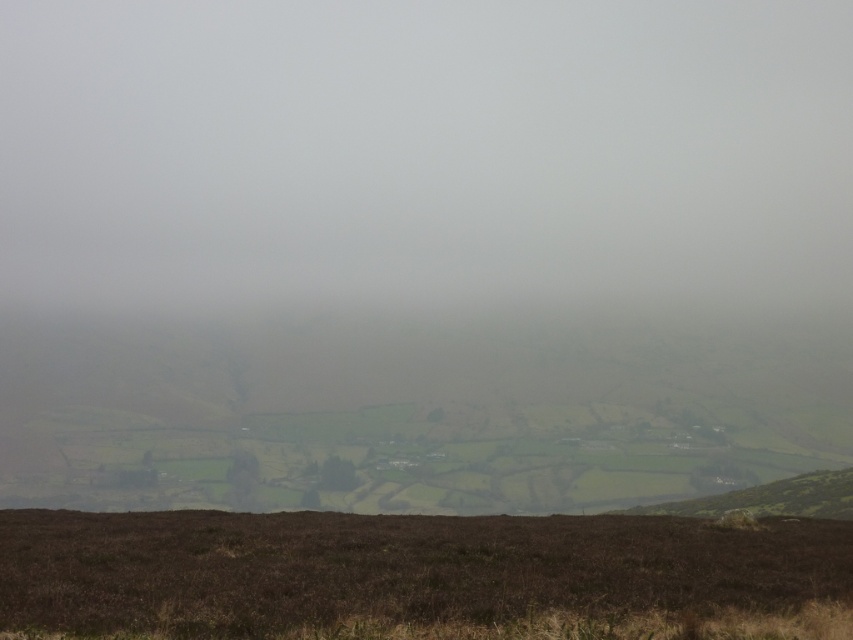
You are standing in the misty rural landscape described. You notice a point marked at coordinates (x=425, y=156). What is located at that point?

The point at coordinates (x=425, y=156) indicates white matte fog at center.